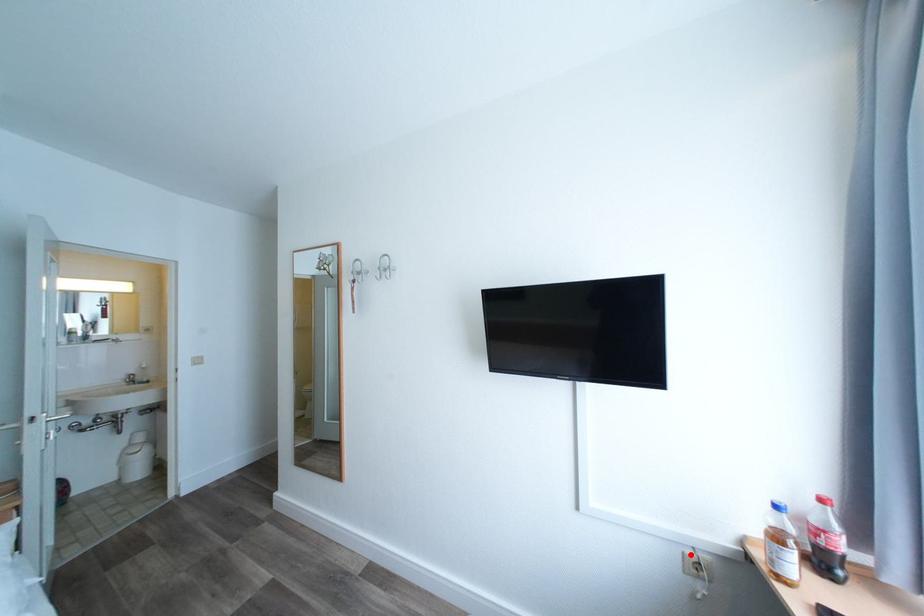
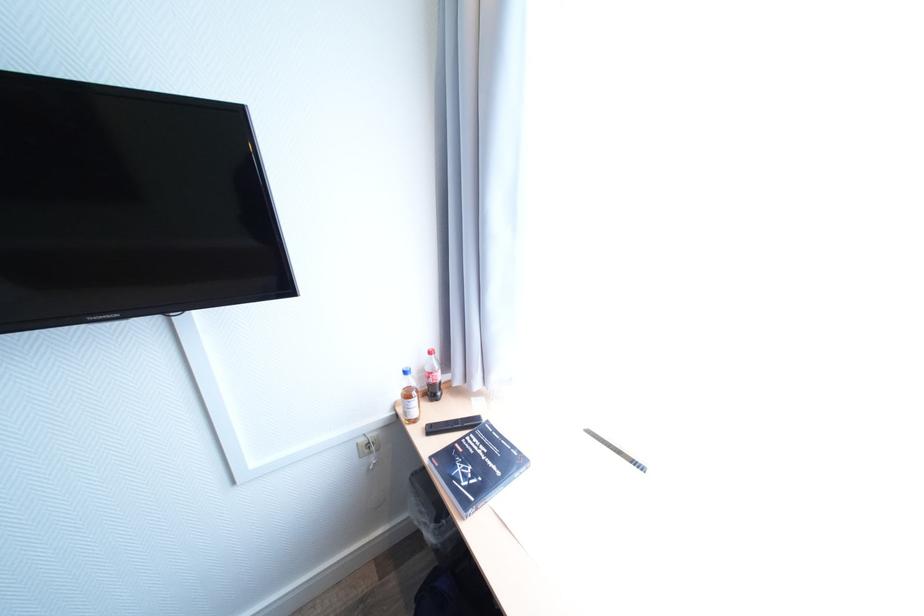
Question: I am providing you with two images of the same scene from different viewpoints. Image1 has a red point marked. In image2, the corresponding 3D location appears at what relative position? Reply with the corresponding letter.

Choices:
 (A) Closer
 (B) Farther

Answer: (B)